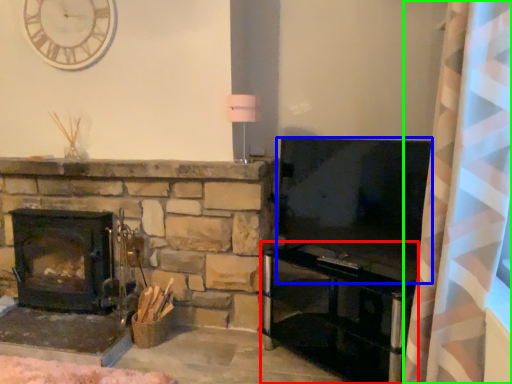
Question: Which object is the farthest from entertainment center (highlighted by a red box)? Choose among these: television (highlighted by a blue box) or curtain (highlighted by a green box).

Choices:
 (A) television
 (B) curtain

Answer: (B)